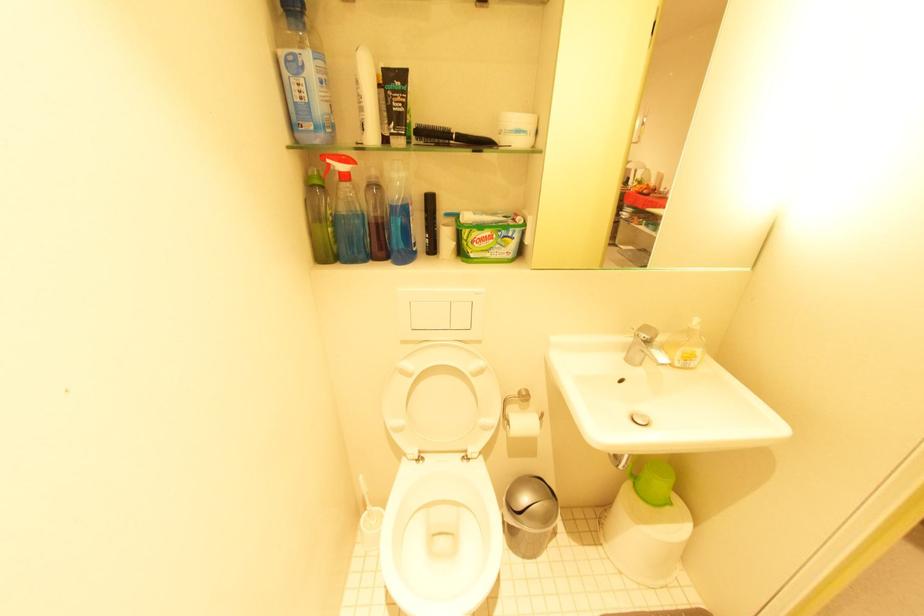
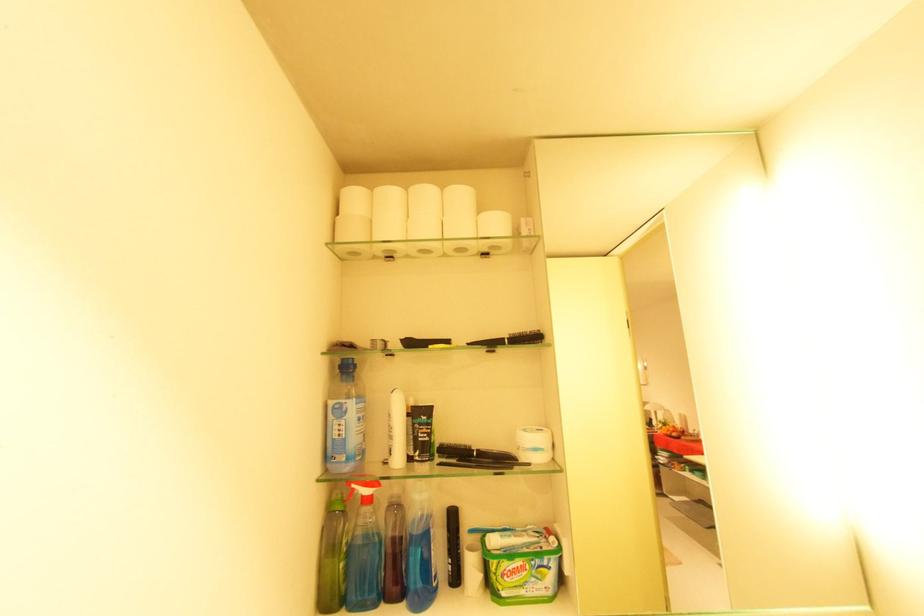
Where in the second image is the point corresponding to pixel 370 114 from the first image?

(398, 442)